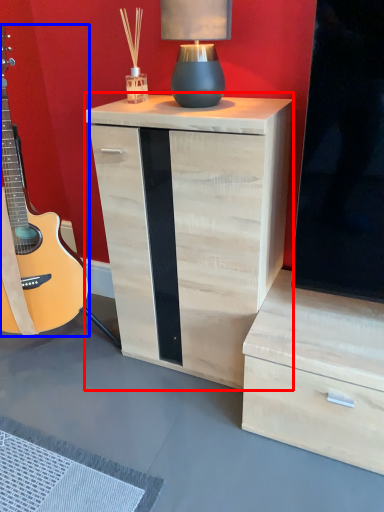
Question: Which object appears closest to the camera in this image, nightstand (highlighted by a red box) or guitar (highlighted by a blue box)?

Choices:
 (A) nightstand
 (B) guitar

Answer: (B)